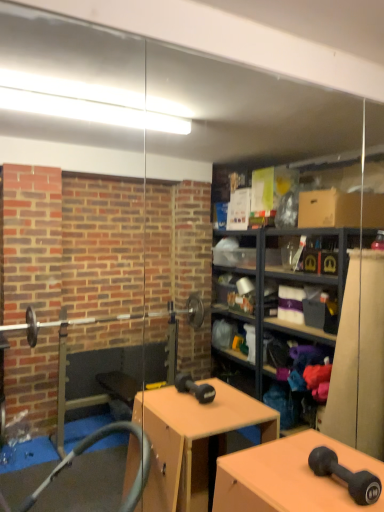
Question: Considering the positions of matte black dumbbell at center and matte black dumbbell at lower right in the image, is matte black dumbbell at center taller or shorter than matte black dumbbell at lower right?

Choices:
 (A) tall
 (B) short

Answer: (A)

Question: Based on their positions, is matte black dumbbell at center located to the left or right of matte black dumbbell at lower right?

Choices:
 (A) right
 (B) left

Answer: (B)

Question: Considering their positions, is matte black dumbbell at center located in front of or behind matte black dumbbell at lower right?

Choices:
 (A) front
 (B) behind

Answer: (A)

Question: In the image, is matte black dumbbell at lower right on the left side or the right side of matte black dumbbell at center?

Choices:
 (A) left
 (B) right

Answer: (B)

Question: In terms of width, does matte black dumbbell at lower right look wider or thinner when compared to matte black dumbbell at center?

Choices:
 (A) thin
 (B) wide

Answer: (A)

Question: Do you think matte black dumbbell at lower right is within matte black dumbbell at center, or outside of it?

Choices:
 (A) inside
 (B) outside

Answer: (B)

Question: Is matte black dumbbell at lower right in front of or behind matte black dumbbell at center in the image?

Choices:
 (A) behind
 (B) front

Answer: (A)